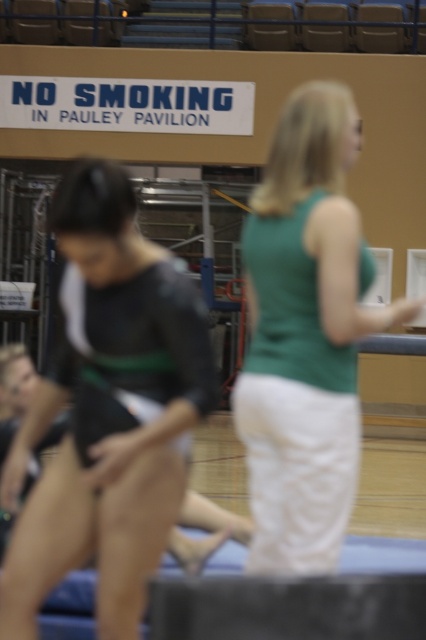
You are a photographer setting up for a photo shoot at Pauley Pavilion. You need to position two models wearing the black leotard at left and the green fabric tank top at center so that they are exactly 1 meter apart. Based on their current positions, do you need to move them closer or farther apart?

The black leotard at left is currently 67.97 centimeters away from the green fabric tank top at center. Since 67.97 cm is less than 1 meter, you need to move them farther apart to reach the desired distance.

You are a photographer setting up for a photoshoot at Pauley Pavilion. You need to position a light source to the right of both the black leotard at left and the green fabric tank top at center. Is this possible given their current positions?

The black leotard at left is to the left of the green fabric tank top at center. Since the black leotard at left is already positioned to the left of the green fabric tank top at center, placing a light source to the right of both would be possible by positioning it further to the right of the green fabric tank top at center.